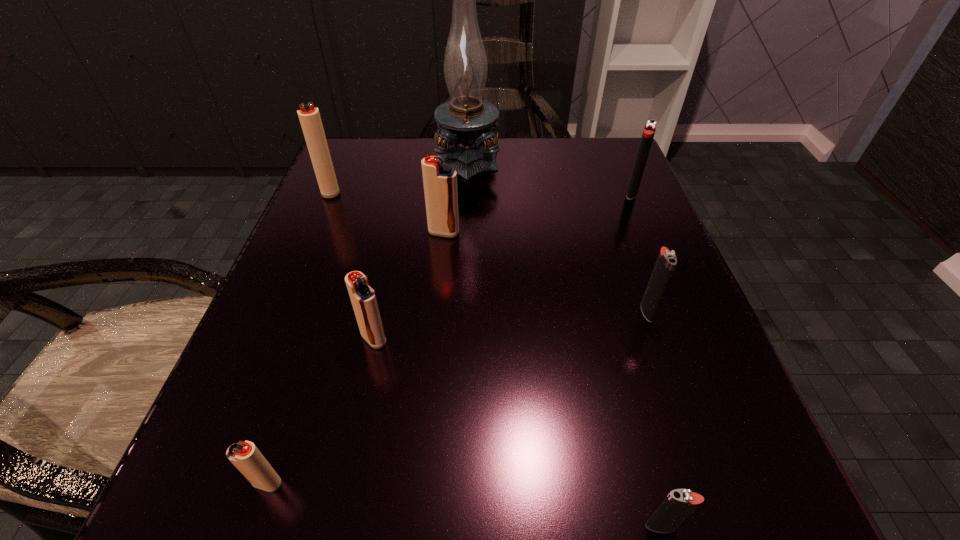
Point out which red igniter is positioned as the second nearest to the third nearest object. Please provide its 2D coordinates. Your answer should be formatted as a tuple, i.e. [(x, y)], where the tuple contains the x and y coordinates of a point satisfying the conditions above.

[(440, 181)]

Locate an element on the screen. This screenshot has width=960, height=540. red igniter object that ranks as the third closest to the fifth farthest object is located at coordinates (245, 456).

Identify the location of the second closest black igniter relative to the farthest black igniter. The image size is (960, 540). (680, 503).

Select which black igniter appears as the closest to the fourth nearest object. Please provide its 2D coordinates. Your answer should be formatted as a tuple, i.e. [(x, y)], where the tuple contains the x and y coordinates of a point satisfying the conditions above.

[(650, 127)]

Where is `vacant area in the image that satisfies the following two spatial constraints: 1. on the back side of the second nearest object; 2. on the left side of the farthest black igniter`? vacant area in the image that satisfies the following two spatial constraints: 1. on the back side of the second nearest object; 2. on the left side of the farthest black igniter is located at coordinates (363, 193).

The width and height of the screenshot is (960, 540). I want to click on vacant region that satisfies the following two spatial constraints: 1. on the back side of the second object from right to left; 2. on the right side of the sixth farthest object, so click(x=379, y=312).

Find the location of a particular element. Image resolution: width=960 pixels, height=540 pixels. blank area in the image that satisfies the following two spatial constraints: 1. on the back side of the third nearest object; 2. on the left side of the farthest black igniter is located at coordinates (404, 193).

Locate an element on the screen. free space that satisfies the following two spatial constraints: 1. on the front side of the second igniter from left to right; 2. on the left side of the farthest red igniter is located at coordinates (206, 483).